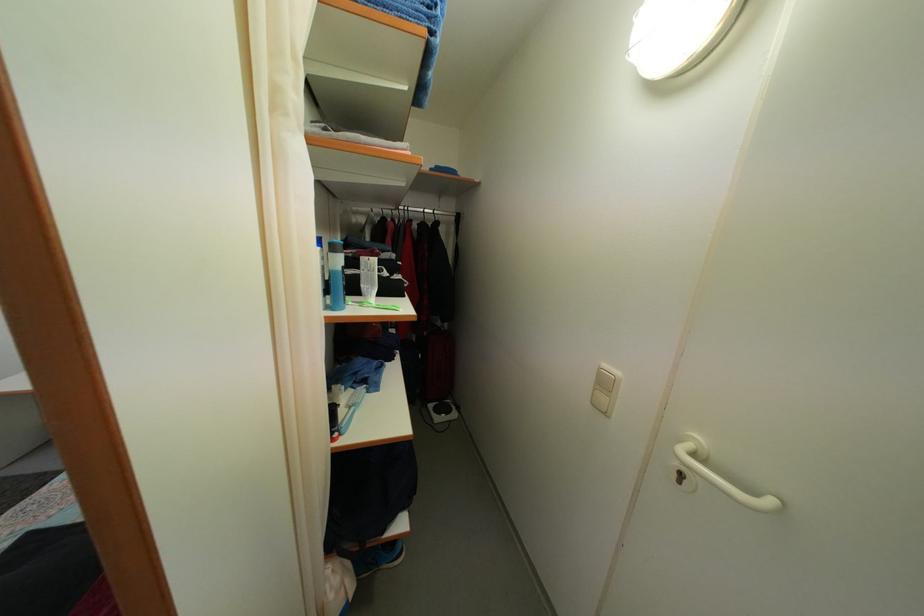
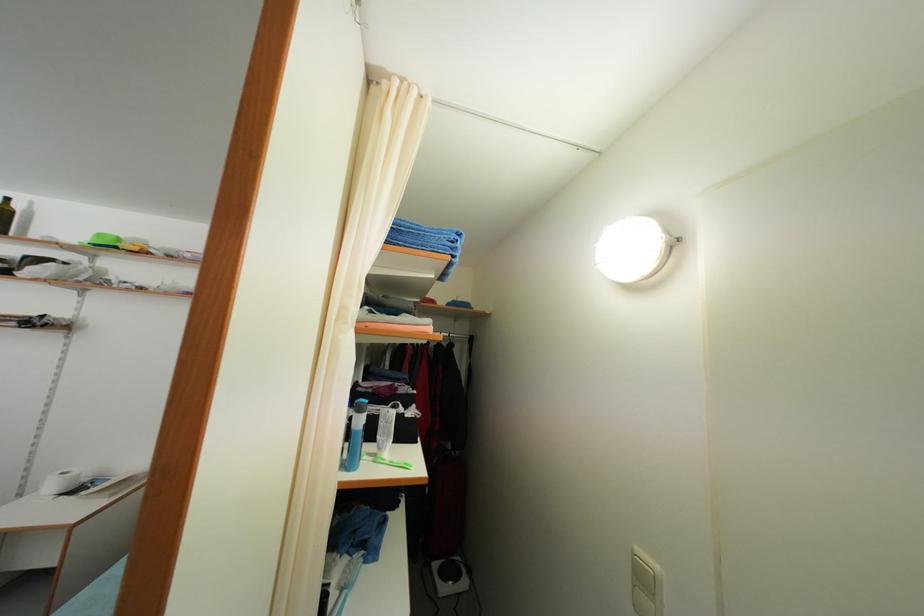
Question: How did the camera likely rotate?

Choices:
 (A) Left
 (B) Right
 (C) Up
 (D) Down

Answer: (C)